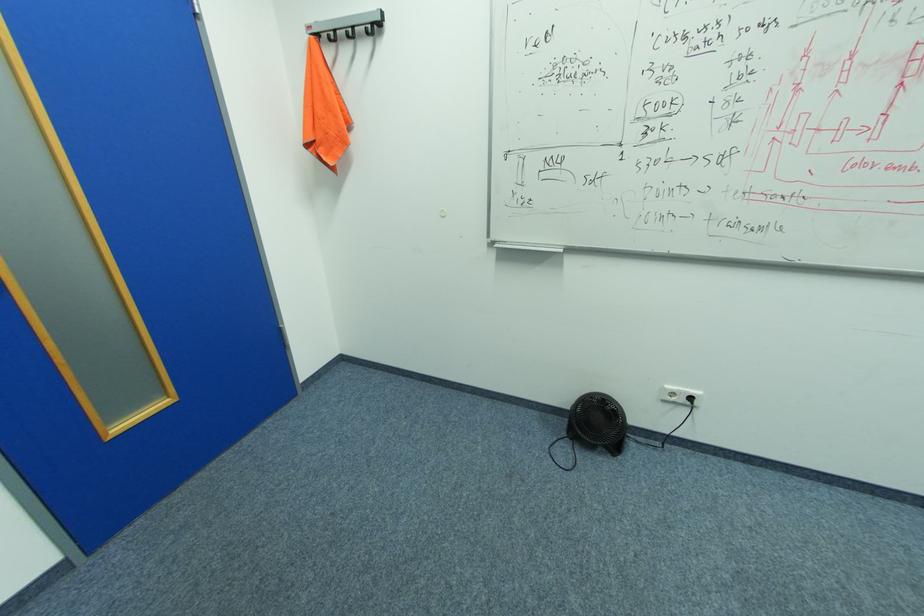
You are a GUI agent. You are given a task and a screenshot of the screen. Output one action in this format:
    pyautogui.click(x=<x>, y=<y>)
    Task: Click on the small black fan
    
    Given the screenshot: What is the action you would take?
    pyautogui.click(x=593, y=426)